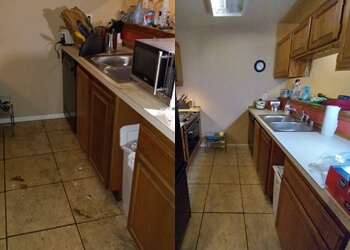
Where is `microwave`? The image size is (350, 250). microwave is located at coordinates (152, 66).